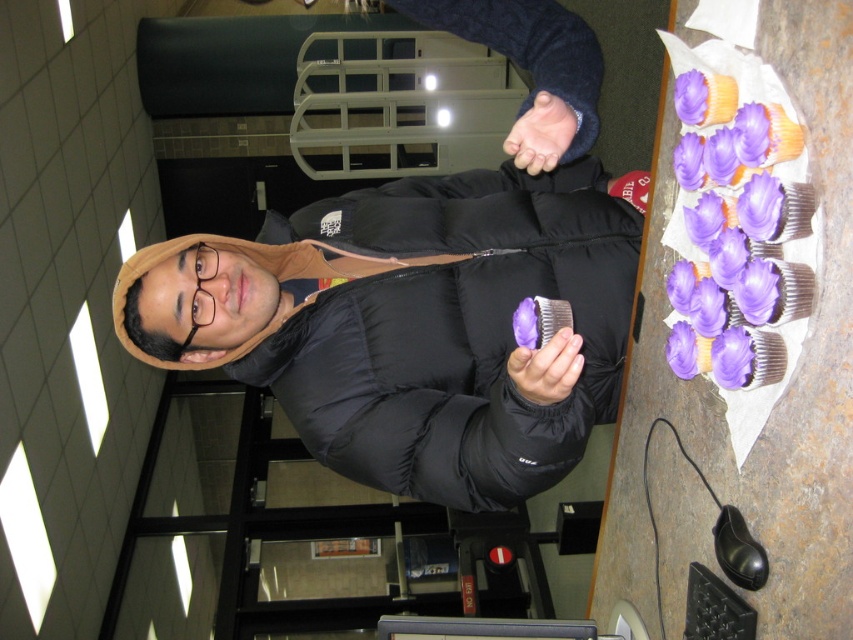
Is black puffy jacket at center taller than purple matte hand at center?

Indeed, black puffy jacket at center has a greater height compared to purple matte hand at center.

Is black puffy jacket at center further to camera compared to purple matte hand at center?

No, it is in front of purple matte hand at center.

Does point (473, 394) lie behind point (524, 132)?

Yes.

Locate an element on the screen. This screenshot has width=853, height=640. black puffy jacket at center is located at coordinates (451, 332).

Which is below, purple matte hand at center or purple matte cupcake at center?

Positioned lower is purple matte cupcake at center.

Which is in front, point (525, 150) or point (558, 369)?

Positioned in front is point (558, 369).

What do you see at coordinates (541, 132) in the screenshot? The width and height of the screenshot is (853, 640). I see `purple matte hand at center` at bounding box center [541, 132].

Locate an element on the screen. purple matte hand at center is located at coordinates (541, 132).

Can you confirm if black puffy jacket at center is bigger than purple matte cupcake at center?

Yes, black puffy jacket at center is bigger than purple matte cupcake at center.

Is point (398, 280) positioned before point (560, 339)?

That is False.

Is point (496, 221) more distant than point (554, 381)?

That is True.

This screenshot has height=640, width=853. Find the location of `black puffy jacket at center`. black puffy jacket at center is located at coordinates (451, 332).